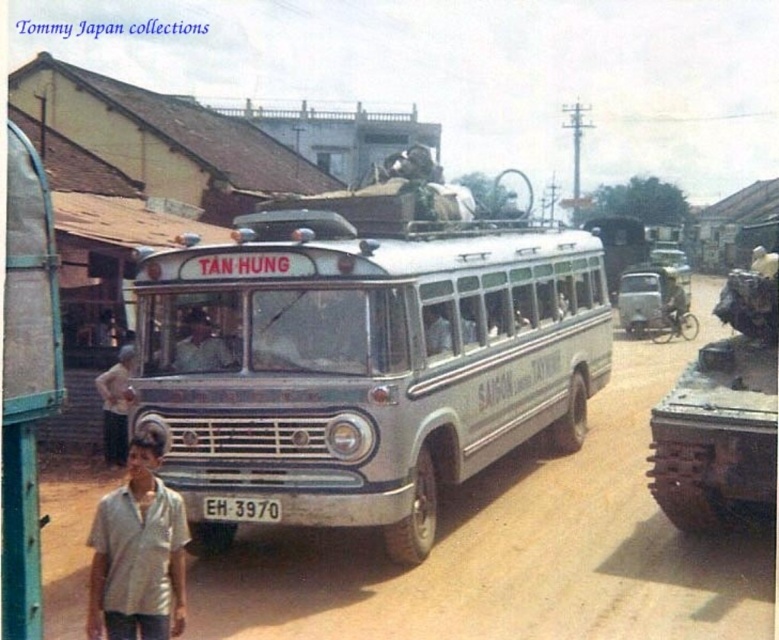
You are standing at the position of point (252, 502) and want to walk towards the bus. Is the point (192, 369) in front of or behind you as you walk towards the bus?

Point (192, 369) is further to the camera than point (252, 502). So as you walk towards the bus from point (252, 502), the point (192, 369) would be in front of you.

You are a photographer trying to capture both the matte black shirt at center and the white plastic license plate at center in a single frame. Which object should you focus on first to ensure both are in the frame?

You should focus on the matte black shirt at center first because it is larger than the white plastic license plate at center, ensuring it fits within the frame while the smaller license plate remains visible.